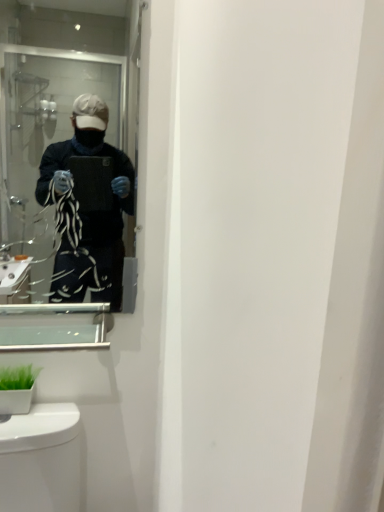
Find the location of a particular element. This screenshot has width=384, height=512. clear glass medicine cabinet at lower left is located at coordinates (53, 326).

What do you see at coordinates (70, 148) in the screenshot?
I see `clear glass mirror at upper left` at bounding box center [70, 148].

What is the approximate height of clear glass mirror at upper left?

clear glass mirror at upper left is 28.47 inches in height.

Measure the distance between point (26, 368) and camera.

Point (26, 368) is 1.08 meters away from camera.

What are the coordinates of `clear glass medicine cabinet at lower left` in the screenshot? It's located at (53, 326).

Which of these two, clear glass medicine cabinet at lower left or clear glass mirror at upper left, is smaller?

Smaller between the two is clear glass medicine cabinet at lower left.

Where is `medicine cabinet located below the clear glass mirror at upper left (from the image's perspective)`? The width and height of the screenshot is (384, 512). medicine cabinet located below the clear glass mirror at upper left (from the image's perspective) is located at coordinates (53, 326).

Is point (58, 335) positioned before point (17, 132)?

Yes.

Is clear glass medicine cabinet at lower left closer to camera compared to clear glass mirror at upper left?

No, clear glass medicine cabinet at lower left is behind clear glass mirror at upper left.

From the picture: Which is more to the left, green matte plant at lower left or clear glass mirror at upper left?

From the viewer's perspective, green matte plant at lower left appears more on the left side.

Based on the photo, from the image's perspective, between green matte plant at lower left and clear glass mirror at upper left, who is located below?

green matte plant at lower left appears lower in the image.

Is point (34, 372) in front of point (114, 149)?

Yes, point (34, 372) is in front of point (114, 149).

Would you say green matte plant at lower left is outside clear glass mirror at upper left?

Absolutely, green matte plant at lower left is external to clear glass mirror at upper left.

From a real-world perspective, which is physically above, green matte plant at lower left or clear glass medicine cabinet at lower left?

From a 3D spatial view, clear glass medicine cabinet at lower left is above.

Is green matte plant at lower left aimed at clear glass medicine cabinet at lower left?

No.

Does green matte plant at lower left have a greater width compared to clear glass medicine cabinet at lower left?

Incorrect, the width of green matte plant at lower left does not surpass that of clear glass medicine cabinet at lower left.

Is point (13, 389) more distant than point (42, 346)?

Yes, it is behind point (42, 346).

Considering the relative sizes of clear glass mirror at upper left and clear glass medicine cabinet at lower left in the image provided, is clear glass mirror at upper left thinner than clear glass medicine cabinet at lower left?

Yes, clear glass mirror at upper left is thinner than clear glass medicine cabinet at lower left.

Can you confirm if clear glass mirror at upper left is taller than clear glass medicine cabinet at lower left?

Indeed, clear glass mirror at upper left has a greater height compared to clear glass medicine cabinet at lower left.

From a real-world perspective, between clear glass mirror at upper left and clear glass medicine cabinet at lower left, who is vertically lower?

clear glass medicine cabinet at lower left.

Between clear glass mirror at upper left and clear glass medicine cabinet at lower left, which one is positioned behind?

clear glass medicine cabinet at lower left.

How different are the orientations of clear glass mirror at upper left and green matte plant at lower left in degrees?

1.09 degrees.

Which object is positioned more to the left, clear glass mirror at upper left or green matte plant at lower left?

Positioned to the left is green matte plant at lower left.

From a real-world perspective, who is located lower, clear glass mirror at upper left or green matte plant at lower left?

In real-world perspective, green matte plant at lower left is lower.

Looking at this image, is clear glass mirror at upper left facing towards green matte plant at lower left?

No, clear glass mirror at upper left is not oriented towards green matte plant at lower left.

Could you tell me if clear glass medicine cabinet at lower left is facing green matte plant at lower left?

No, clear glass medicine cabinet at lower left does not turn towards green matte plant at lower left.

Between point (105, 315) and point (9, 378), which one is positioned behind?

The point (105, 315) is more distant.

From a real-world perspective, relative to green matte plant at lower left, is clear glass medicine cabinet at lower left vertically above or below?

clear glass medicine cabinet at lower left is situated higher than green matte plant at lower left in the real world.

Image resolution: width=384 pixels, height=512 pixels. In order to click on medicine cabinet below the clear glass mirror at upper left (from the image's perspective) in this screenshot , I will do `click(53, 326)`.

The image size is (384, 512). Find the location of `plant located on the left of clear glass mirror at upper left`. plant located on the left of clear glass mirror at upper left is located at coordinates (18, 377).

When comparing their distances from clear glass medicine cabinet at lower left, does clear glass mirror at upper left or green matte plant at lower left seem further?

The object further to clear glass medicine cabinet at lower left is clear glass mirror at upper left.

Based on their spatial positions, is clear glass mirror at upper left or clear glass medicine cabinet at lower left closer to green matte plant at lower left?

clear glass medicine cabinet at lower left is closer to green matte plant at lower left.

When comparing their distances from clear glass medicine cabinet at lower left, does green matte plant at lower left or clear glass mirror at upper left seem further?

Based on the image, clear glass mirror at upper left appears to be further to clear glass medicine cabinet at lower left.

From the picture: When comparing their distances from clear glass mirror at upper left, does green matte plant at lower left or clear glass medicine cabinet at lower left seem closer?

Based on the image, clear glass medicine cabinet at lower left appears to be nearer to clear glass mirror at upper left.

Estimate the real-world distances between objects in this image. Which object is further from clear glass mirror at upper left, clear glass medicine cabinet at lower left or green matte plant at lower left?

green matte plant at lower left is positioned further to the anchor clear glass mirror at upper left.

From the image, which object appears to be nearer to green matte plant at lower left, clear glass medicine cabinet at lower left or clear glass mirror at upper left?

clear glass medicine cabinet at lower left is positioned closer to the anchor green matte plant at lower left.

Locate an element on the screen. The height and width of the screenshot is (512, 384). medicine cabinet that lies between clear glass mirror at upper left and green matte plant at lower left from top to bottom is located at coordinates tap(53, 326).